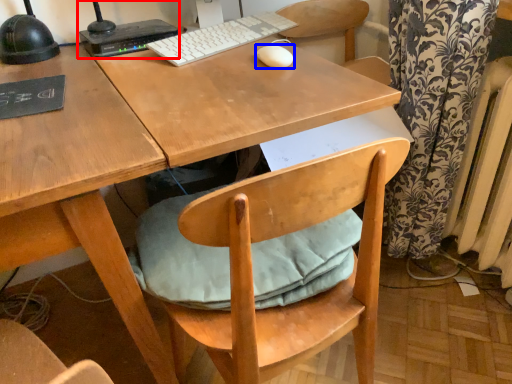
Question: Which object appears farthest to the camera in this image, desktop computer (highlighted by a red box) or mouse (highlighted by a blue box)?

Choices:
 (A) desktop computer
 (B) mouse

Answer: (A)